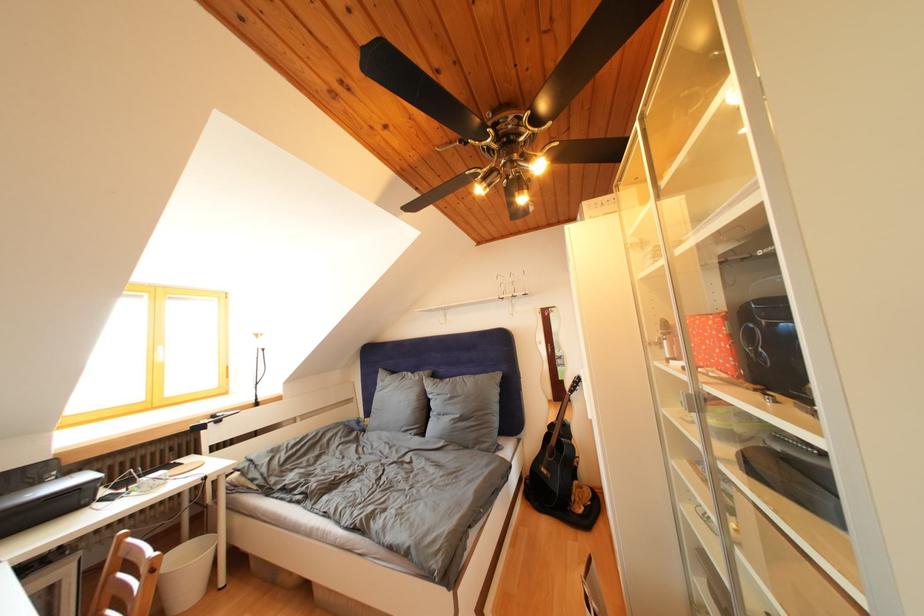
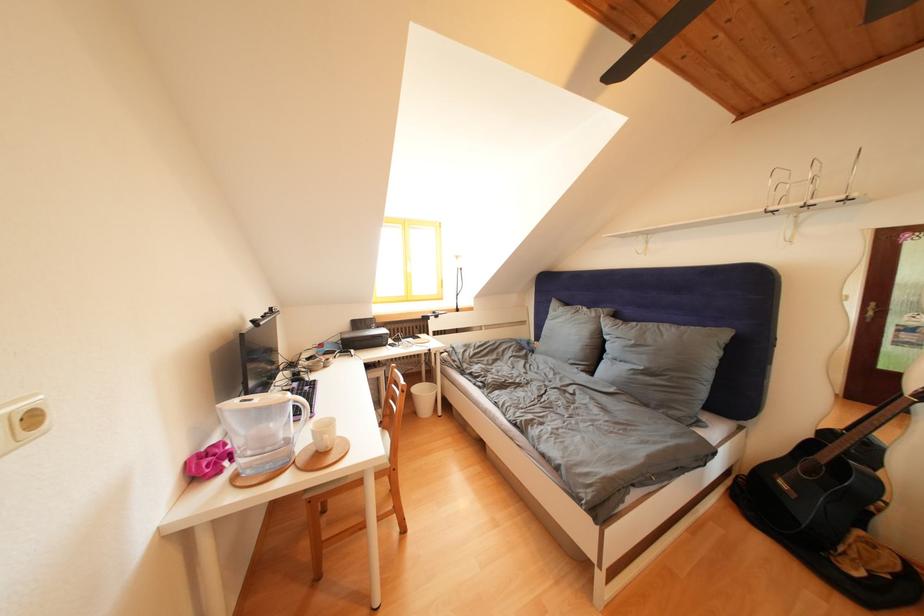
The point at (426,383) is marked in the first image. Where is the corresponding point in the second image?

(602, 320)